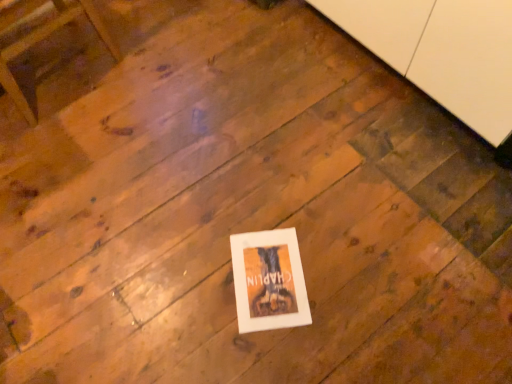
Question: From the image's perspective, is white paper at center on top of wooden chair at upper left?

Choices:
 (A) no
 (B) yes

Answer: (A)

Question: Is the position of white paper at center more distant than that of wooden chair at upper left?

Choices:
 (A) yes
 (B) no

Answer: (A)

Question: Is white paper at center completely or partially outside of wooden chair at upper left?

Choices:
 (A) yes
 (B) no

Answer: (A)

Question: Is white paper at center oriented away from wooden chair at upper left?

Choices:
 (A) no
 (B) yes

Answer: (A)

Question: Does white paper at center turn towards wooden chair at upper left?

Choices:
 (A) yes
 (B) no

Answer: (B)

Question: Is white paper at center in front of wooden chair at upper left?

Choices:
 (A) no
 (B) yes

Answer: (A)

Question: Is white matte cabinet at upper right touching white paper at center?

Choices:
 (A) no
 (B) yes

Answer: (A)

Question: Is the depth of white matte cabinet at upper right greater than that of white paper at center?

Choices:
 (A) yes
 (B) no

Answer: (B)

Question: Is white matte cabinet at upper right at the right side of white paper at center?

Choices:
 (A) no
 (B) yes

Answer: (B)

Question: From the image's perspective, is white matte cabinet at upper right located above white paper at center?

Choices:
 (A) yes
 (B) no

Answer: (A)

Question: Considering the relative sizes of white matte cabinet at upper right and white paper at center in the image provided, is white matte cabinet at upper right thinner than white paper at center?

Choices:
 (A) yes
 (B) no

Answer: (B)

Question: From a real-world perspective, is white matte cabinet at upper right on top of white paper at center?

Choices:
 (A) yes
 (B) no

Answer: (A)

Question: Is white matte cabinet at upper right smaller than wooden chair at upper left?

Choices:
 (A) no
 (B) yes

Answer: (A)